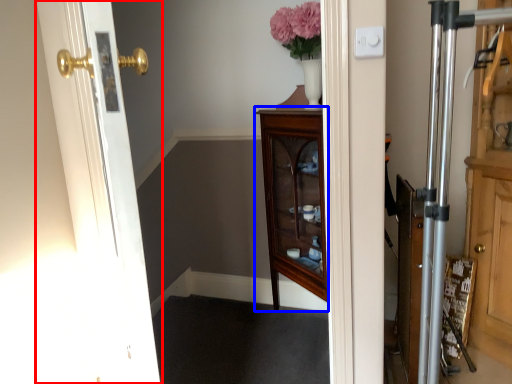
Question: Among these objects, which one is nearest to the camera, door (highlighted by a red box) or furniture (highlighted by a blue box)?

Choices:
 (A) door
 (B) furniture

Answer: (A)